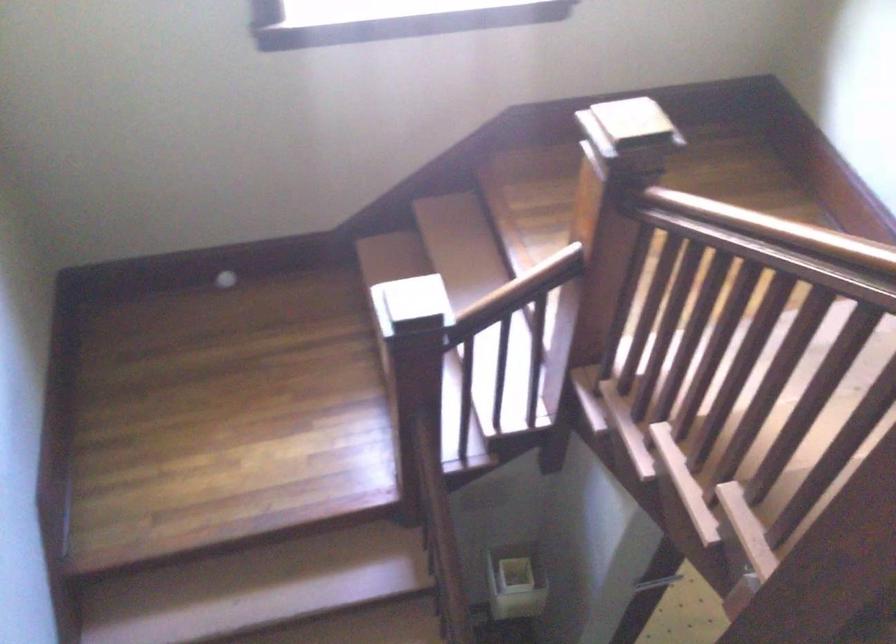
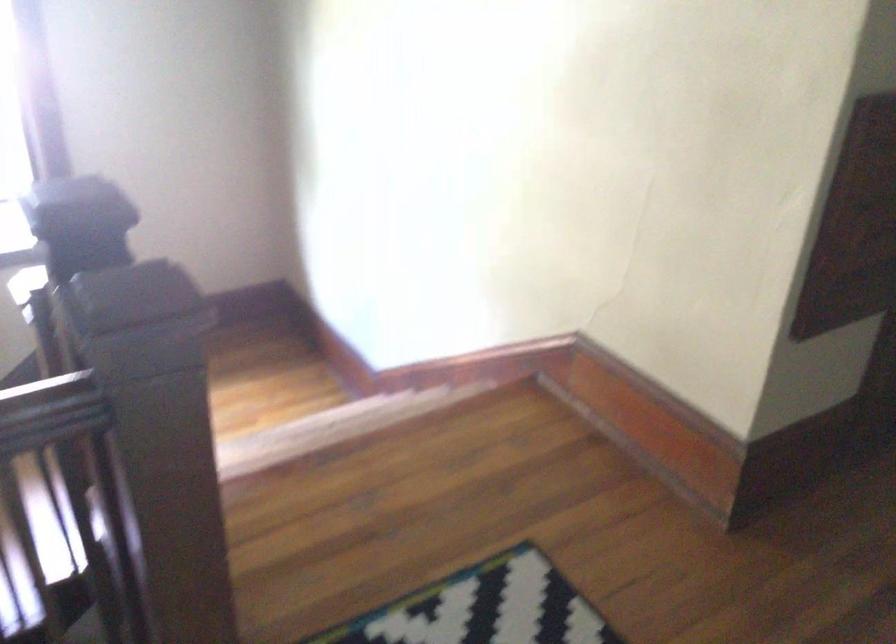
Question: I am providing you with two images of the same scene from different viewpoints. Which of the following objects are not visible in image2?

Choices:
 (A) wooden stair handrail
 (B) wooden newel post
 (C) wooden handrail
 (D) light green bag

Answer: (A)